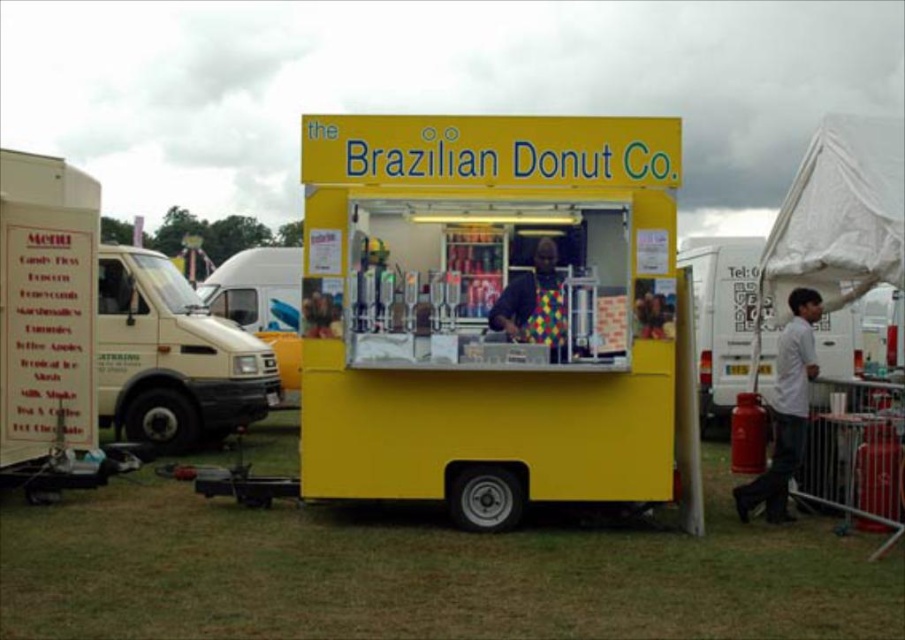
Question: Is matte cream van at left wider than multicolored apron at center?

Choices:
 (A) no
 (B) yes

Answer: (B)

Question: Which of the following is the farthest from the observer?

Choices:
 (A) (165, 349)
 (B) (521, 403)
 (C) (70, 548)
 (D) (813, 312)

Answer: (A)

Question: Can you confirm if matte cream van at left is smaller than multicolored apron at center?

Choices:
 (A) no
 (B) yes

Answer: (A)

Question: Among these points, which one is farthest from the camera?

Choices:
 (A) (537, 308)
 (B) (138, 392)
 (C) (176, 547)

Answer: (B)

Question: Is yellow matte food truck at center positioned behind white cotton shirt at right?

Choices:
 (A) yes
 (B) no

Answer: (B)

Question: Which point is closer to the camera?

Choices:
 (A) pos(507,340)
 (B) pos(437,560)
 (C) pos(607,232)

Answer: (B)